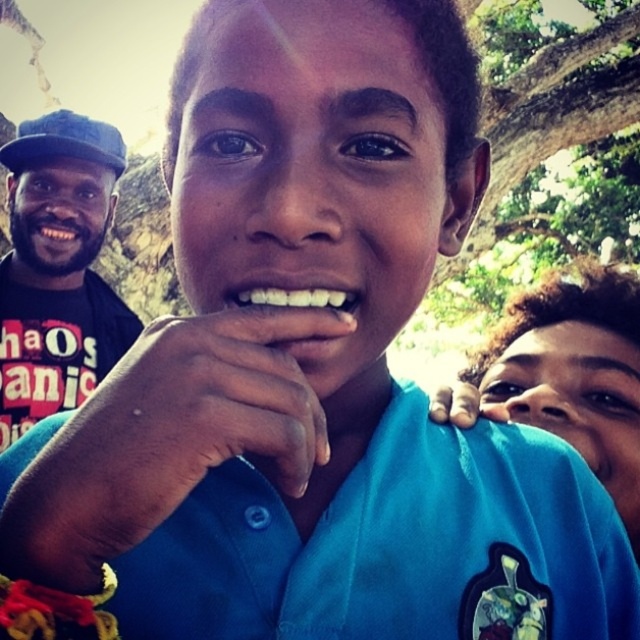
Is point (464, 371) farther from camera compared to point (332, 288)?

That is True.

Can you confirm if blue fabric shirt at center is thinner than white glossy teeth at center?

No, blue fabric shirt at center is not thinner than white glossy teeth at center.

In order to click on blue fabric shirt at center in this screenshot , I will do `click(564, 374)`.

Between black fabric shirt at left and blue fabric shirt at center, which one has more height?

Standing taller between the two is black fabric shirt at left.

Is point (70, 262) closer to viewer compared to point (508, 356)?

No.

Identify the location of black fabric shirt at left. The height and width of the screenshot is (640, 640). (58, 268).

What do you see at coordinates (58, 268) in the screenshot? I see `black fabric shirt at left` at bounding box center [58, 268].

Find the location of a particular element. The image size is (640, 640). black fabric shirt at left is located at coordinates 58,268.